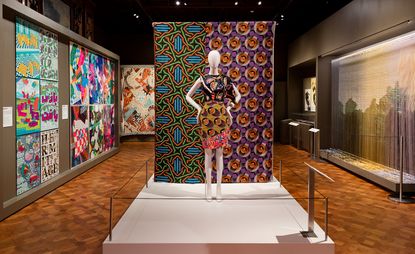
Where is `walls`? The image size is (415, 254). walls is located at coordinates (349, 28), (65, 7).